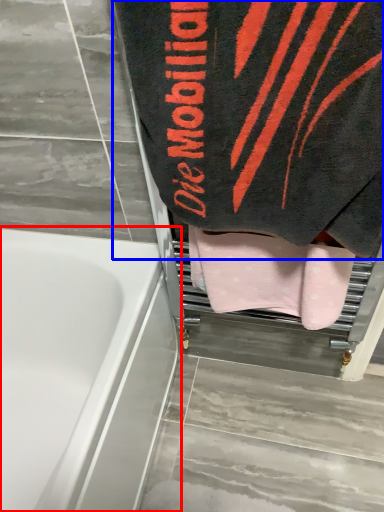
Question: Which object appears farthest to the camera in this image, bathtub (highlighted by a red box) or towel (highlighted by a blue box)?

Choices:
 (A) bathtub
 (B) towel

Answer: (A)